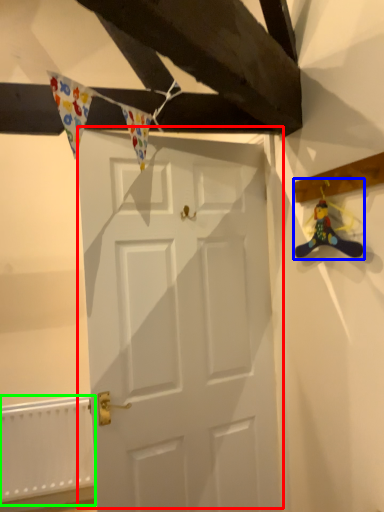
Question: Which object is the closest to the door (highlighted by a red box)? Choose among these: miniature (highlighted by a blue box) or radiator (highlighted by a green box).

Choices:
 (A) miniature
 (B) radiator

Answer: (A)